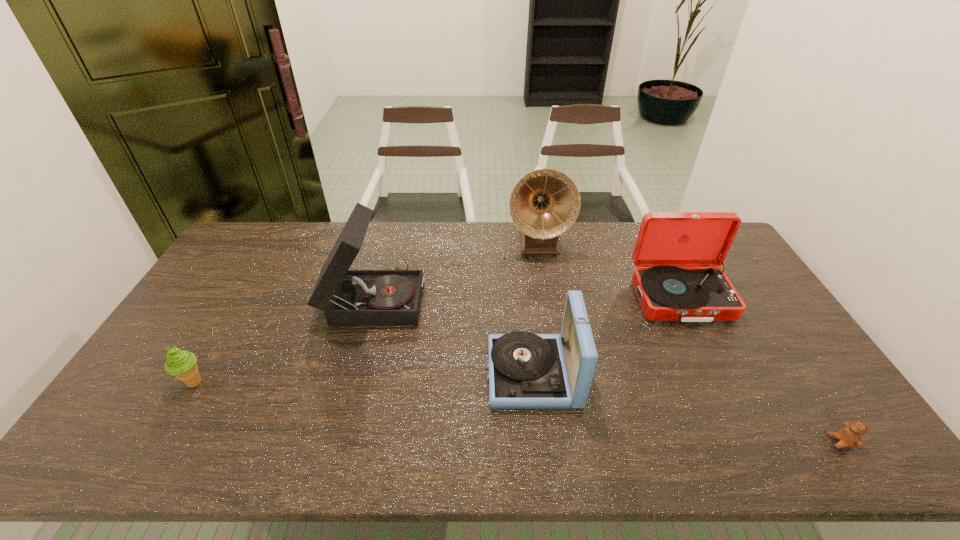
What are the coordinates of `vacant point located 0.260m on the horn of the farthest phonograph record` in the screenshot? It's located at (549, 314).

What are the coordinates of `vacant point located on the front-facing side of the leftmost phonograph record` in the screenshot? It's located at (535, 298).

Find the location of a particular element. This screenshot has height=540, width=960. free region located on the front-facing side of the third tallest phonograph record is located at coordinates (703, 344).

This screenshot has width=960, height=540. Find the location of `vacant area situated 0.160m on the back of the fourth tallest object`. vacant area situated 0.160m on the back of the fourth tallest object is located at coordinates (524, 302).

At what (x,y) coordinates should I click in order to perform the action: click on free spot located on the front of the icecream. Please return your answer as a coordinate pair (x, y). This screenshot has width=960, height=540. Looking at the image, I should click on (153, 453).

Where is `vacant space located on the face of the shortest object`? vacant space located on the face of the shortest object is located at coordinates (660, 442).

Where is `free point located 0.250m on the face of the shortest object`? The image size is (960, 540). free point located 0.250m on the face of the shortest object is located at coordinates (724, 442).

Identify the location of vacant space situated on the face of the shortest object. The image size is (960, 540). (715, 442).

Find the location of a particular element. object present at the far edge is located at coordinates (545, 203).

This screenshot has width=960, height=540. I want to click on object at the near edge, so click(851, 435).